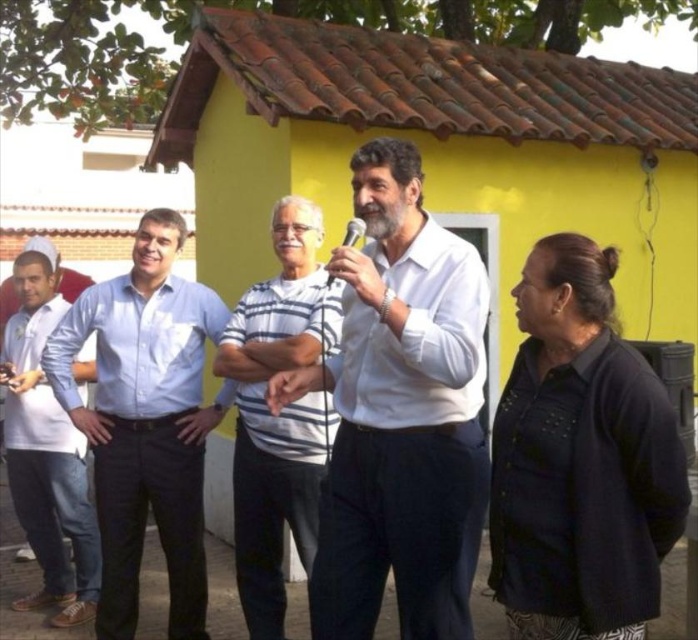
Which is below, white matte shirt at center or black plastic microphone at center?

white matte shirt at center is lower down.

Which is more to the right, white matte shirt at center or black plastic microphone at center?

white matte shirt at center is more to the right.

You are a GUI agent. You are given a task and a screenshot of the screen. Output one action in this format:
    pyautogui.click(x=<x>, y=<y>)
    Task: Click on the white matte shirt at center
    
    Given the screenshot: What is the action you would take?
    pyautogui.click(x=400, y=413)

Who is shorter, light blue shirt at center or gray striped shirt at center?

With less height is gray striped shirt at center.

You are a GUI agent. You are given a task and a screenshot of the screen. Output one action in this format:
    pyautogui.click(x=<x>, y=<y>)
    Task: Click on the light blue shirt at center
    Image resolution: width=698 pixels, height=640 pixels.
    Given the screenshot: What is the action you would take?
    pyautogui.click(x=144, y=420)

Locate an element on the screen. Image resolution: width=698 pixels, height=640 pixels. light blue shirt at center is located at coordinates pos(144,420).

Can you confirm if light blue shirt at center is positioned below black plastic microphone at center?

Yes, light blue shirt at center is below black plastic microphone at center.

Is light blue shirt at center closer to the viewer compared to black plastic microphone at center?

No.

Between point (181, 621) and point (357, 228), which one is positioned in front?

Point (357, 228)

Find the location of a particular element. The image size is (698, 640). light blue shirt at center is located at coordinates (144, 420).